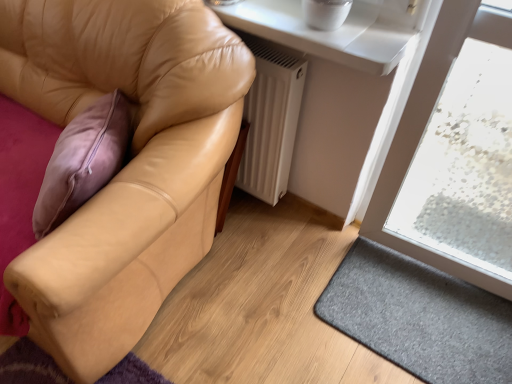
This screenshot has width=512, height=384. Find the location of `free point above gray felt doormat at lower right (from a real-world perspective)`. free point above gray felt doormat at lower right (from a real-world perspective) is located at coordinates (421, 307).